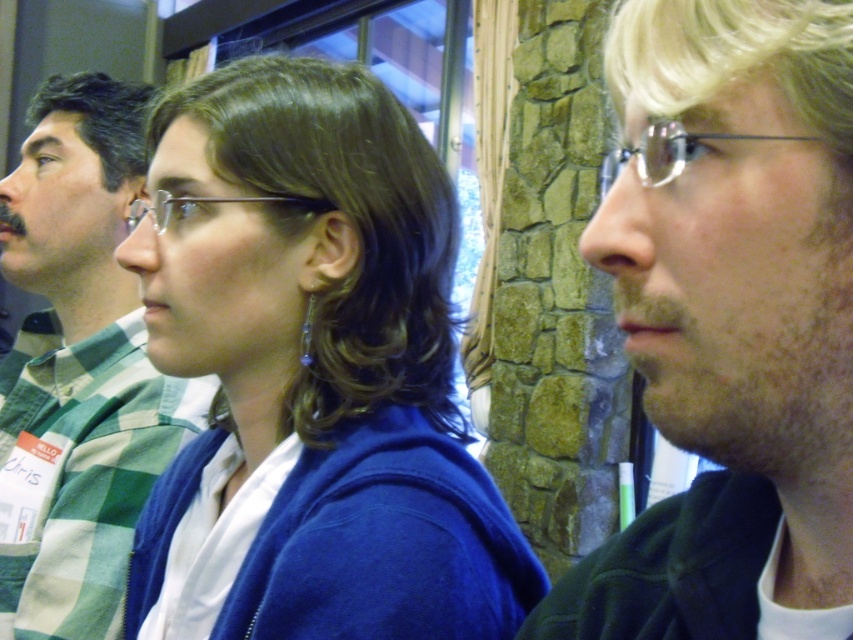
Does blue matte sweater at center come in front of blonde hair at right?

No, it is not.

Is blue matte sweater at center shorter than blonde hair at right?

No, blue matte sweater at center is not shorter than blonde hair at right.

Is point (339, 400) farther from viewer compared to point (666, 102)?

Yes.

Image resolution: width=853 pixels, height=640 pixels. Find the location of `blue matte sweater at center`. blue matte sweater at center is located at coordinates (311, 372).

Does blonde hair at right come behind green checkered shirt at left?

No, it is in front of green checkered shirt at left.

Based on the photo, can you confirm if blonde hair at right is wider than green checkered shirt at left?

Incorrect, blonde hair at right's width does not surpass green checkered shirt at left's.

Between point (817, 113) and point (96, 179), which one is positioned in front?

Positioned in front is point (817, 113).

Find the location of a particular element. The height and width of the screenshot is (640, 853). blonde hair at right is located at coordinates pyautogui.click(x=729, y=321).

Between blue matte sweater at center and green checkered shirt at left, which one has more height?

With more height is green checkered shirt at left.

Is blue matte sweater at center taller than green checkered shirt at left?

In fact, blue matte sweater at center may be shorter than green checkered shirt at left.

Is point (389, 337) positioned after point (45, 253)?

No, (389, 337) is closer to viewer.

Find the location of a particular element. The height and width of the screenshot is (640, 853). blue matte sweater at center is located at coordinates (311, 372).